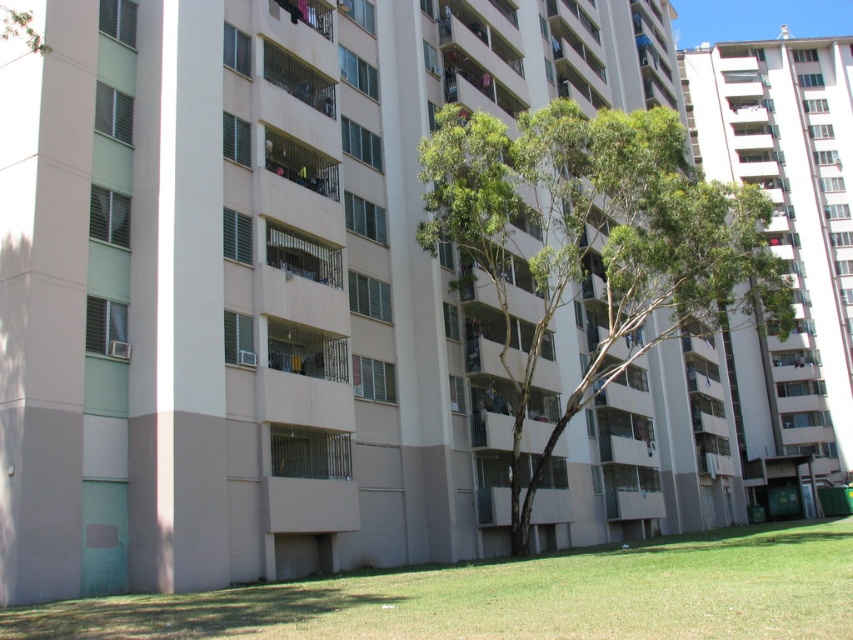
Question: Which point is farther from the camera taking this photo?

Choices:
 (A) pyautogui.click(x=834, y=525)
 (B) pyautogui.click(x=697, y=332)

Answer: (B)

Question: Does green leafy tree at center have a lesser width compared to green grass at lower center?

Choices:
 (A) yes
 (B) no

Answer: (B)

Question: Is green leafy tree at center wider than green grass at lower center?

Choices:
 (A) yes
 (B) no

Answer: (A)

Question: Does green leafy tree at center appear over green grass at lower center?

Choices:
 (A) no
 (B) yes

Answer: (B)